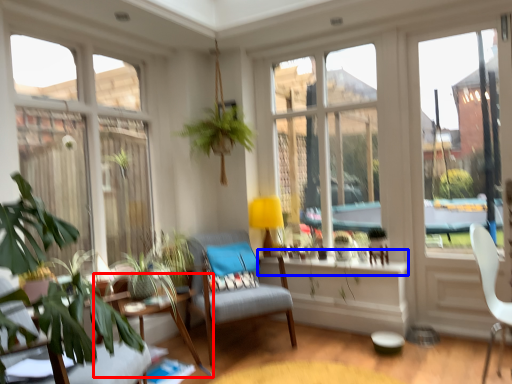
Question: Which object appears farthest to the camera in this image, table (highlighted by a red box) or window sill (highlighted by a blue box)?

Choices:
 (A) table
 (B) window sill

Answer: (B)